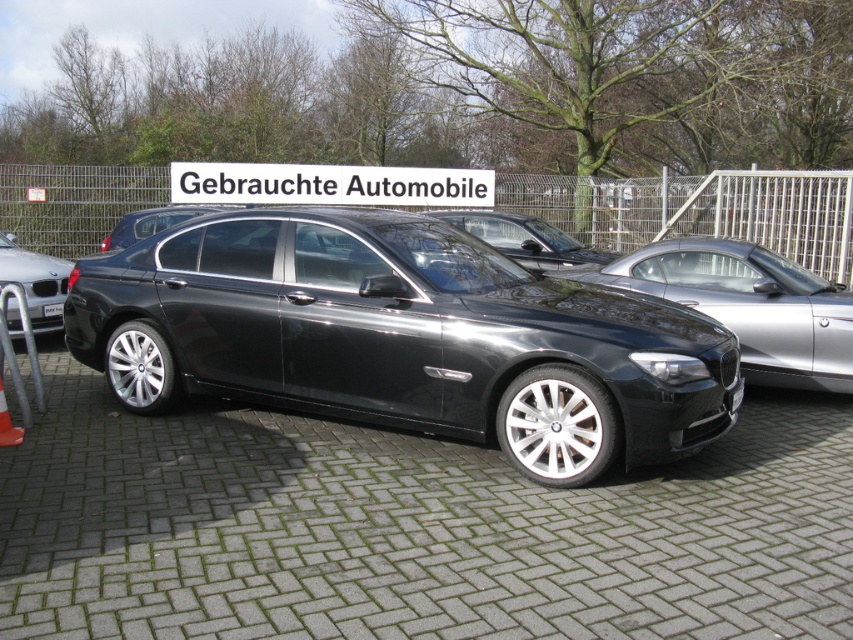
Identify the location of glossy metallic car at center. The height and width of the screenshot is (640, 853). (403, 337).

Where is `glossy metallic car at center`? glossy metallic car at center is located at coordinates (403, 337).

Locate an element on the screen. glossy black car at center is located at coordinates [525, 237].

Can you confirm if glossy black car at center is bigger than satin black sedan at center?

Yes, glossy black car at center is bigger than satin black sedan at center.

Which is behind, point (509, 243) or point (120, 225)?

The point (509, 243) is more distant.

Where is `glossy black car at center`? The height and width of the screenshot is (640, 853). glossy black car at center is located at coordinates (525, 237).

Who is more distant from viewer, (306, 196) or (120, 236)?

Positioned behind is point (306, 196).

Is white plastic sign at center wider than satin black sedan at center?

In fact, white plastic sign at center might be narrower than satin black sedan at center.

The height and width of the screenshot is (640, 853). Describe the element at coordinates (328, 184) in the screenshot. I see `white plastic sign at center` at that location.

Locate an element on the screen. The height and width of the screenshot is (640, 853). white plastic sign at center is located at coordinates (328, 184).